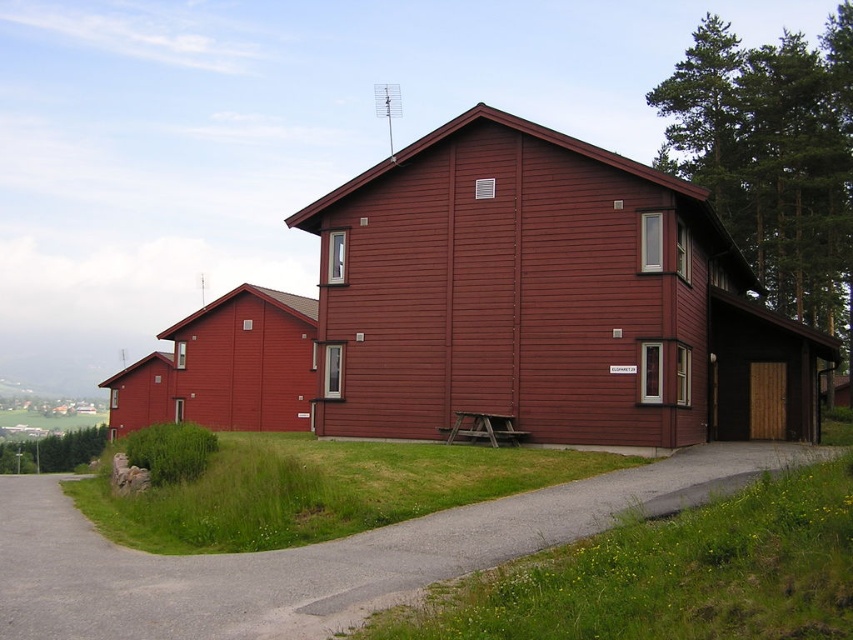
You are driving a car that is 2 meters wide. You need to park your car on the gray asphalt driveway at lower left near the matte wood barn at center. Can your car fit on the driveway?

The matte wood barn at center is wider than the gray asphalt driveway at lower left, but the question is about the driveway width. Since the driveway is narrower than the barn, and the car is 2 meters wide, we need to know the driveway width. However, the description only states the barn is wider. Without specific measurements for the driveway, we can infer it might be too narrow. But since the car is 2m, and driveways are typically wider than 2m, maybe it can fit. Hmm, this is unclear. The answer should be

From the picture: You are standing at the entrance of the rural area and want to locate the matte wood barn at center. According to the coordinates provided, where should you look relative to your current position?

The matte wood barn at center is located at coordinates point (543, 300), which means it is positioned slightly to the right and lower center of your current view.